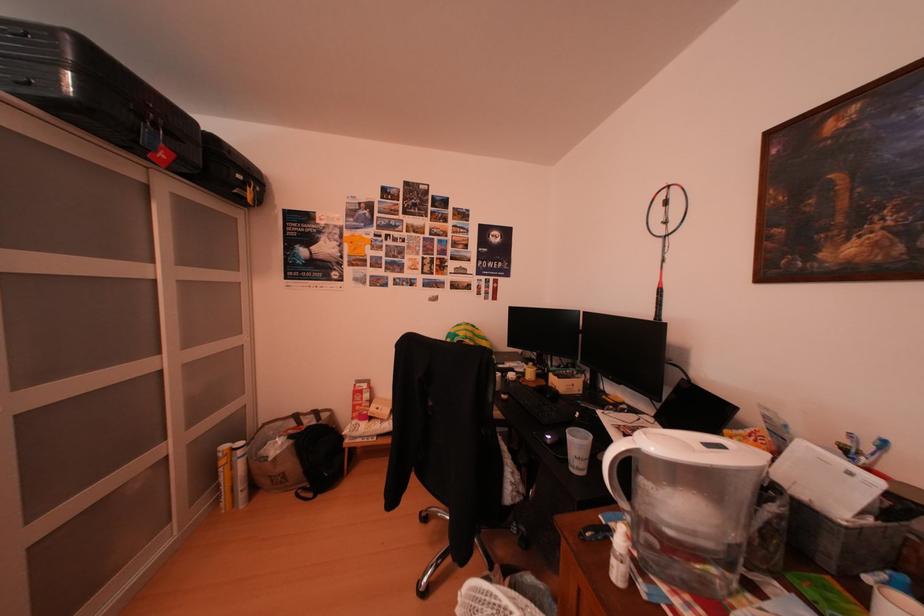
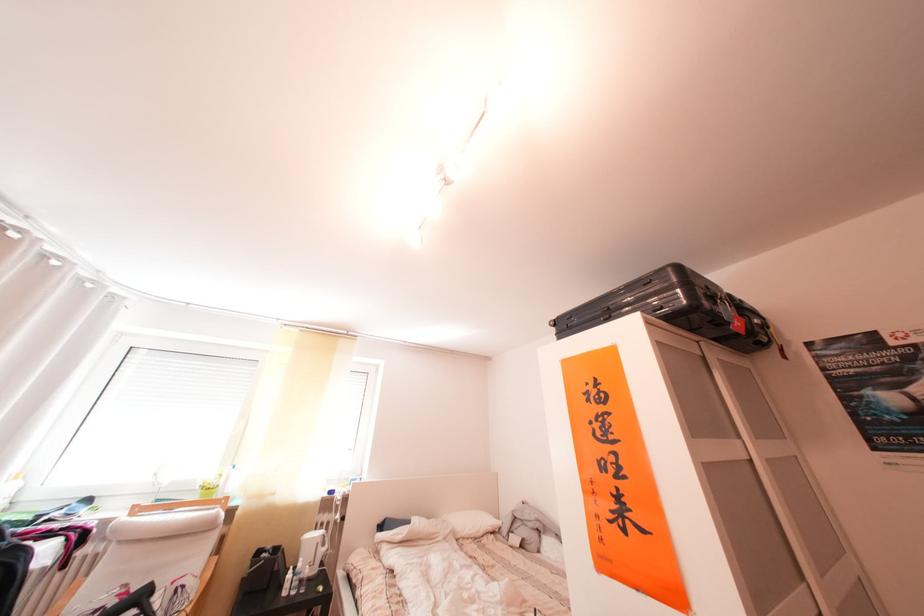
How did the camera likely rotate?

The camera's rotation is toward left-up.